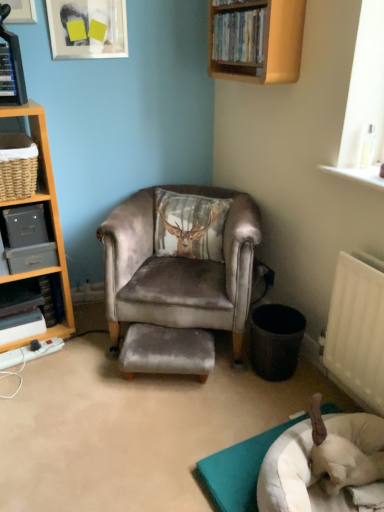
Where is `vacant space situated on the left part of velvet grey stool at center`? Image resolution: width=384 pixels, height=512 pixels. vacant space situated on the left part of velvet grey stool at center is located at coordinates (95, 381).